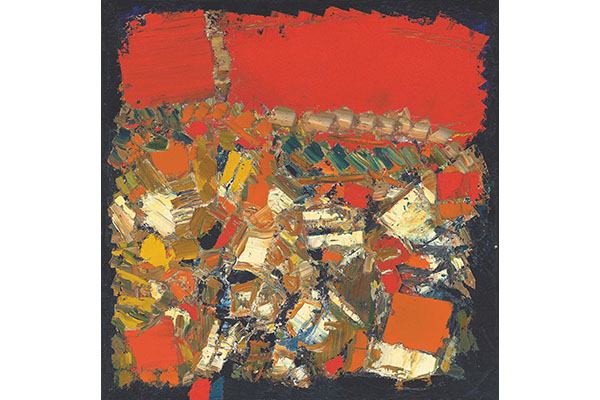
Find the location of `left of painting`. left of painting is located at coordinates (114, 195).